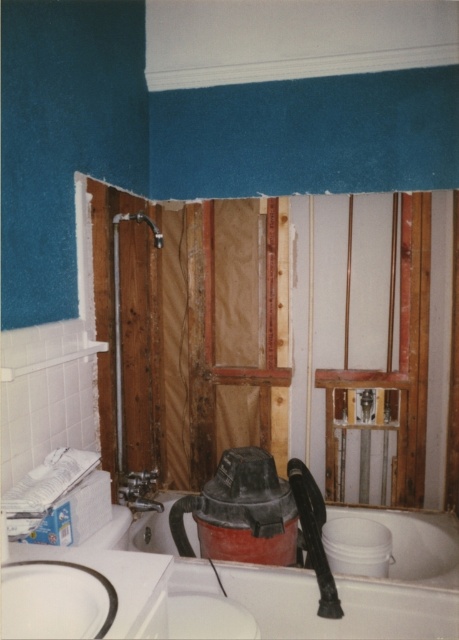
You are a contractor working in this bathroom. You need to move a tool from point A to point B. Point A is at coordinates point (118, 628) and point B is at coordinates point (269, 198). Which point is closer to the sink located in the bottom left corner?

Point (269, 198) is closer to the sink located in the bottom left corner because it is positioned further back in the bathroom compared to point (118, 628), which is in front of it.